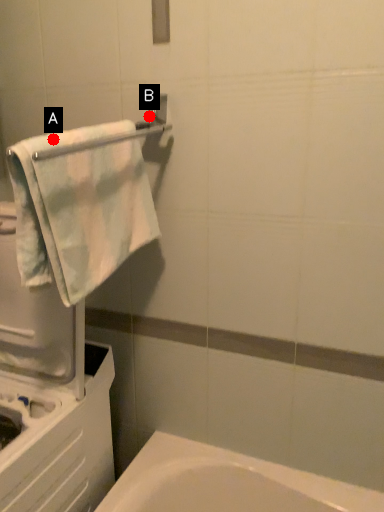
Question: Two points are circled on the image, labeled by A and B beside each circle. Which of the following is the closest to the observer?

Choices:
 (A) A is closer
 (B) B is closer

Answer: (A)